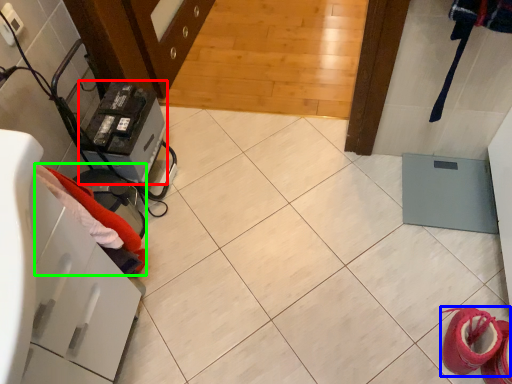
Question: Which object is positioned farthest from appliance (highlighted by a red box)? Select from footwear (highlighted by a blue box) and clothing (highlighted by a green box).

Choices:
 (A) footwear
 (B) clothing

Answer: (A)